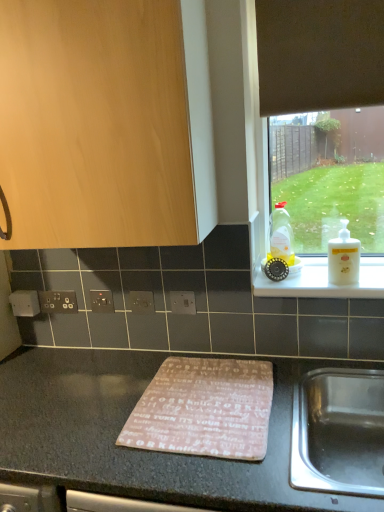
Question: Is wooden cabinet at upper left in front of or behind white plastic ledge at upper right in the image?

Choices:
 (A) front
 (B) behind

Answer: (A)

Question: Considering the positions of wooden cabinet at upper left and white plastic ledge at upper right in the image, is wooden cabinet at upper left wider or thinner than white plastic ledge at upper right?

Choices:
 (A) thin
 (B) wide

Answer: (B)

Question: Considering the real-world distances, which object is farthest from the satin silver switch at center, which is counted as the third electric outlet, starting from the left?

Choices:
 (A) matte gray electric outlet at center, acting as the 4th electric outlet starting from the left
 (B) black plastic electric outlet at center, positioned as the second electric outlet in left-to-right order
 (C) wooden cabinet at upper left
 (D) translucent plastic bottle at right, which is the 2th bottle from right to left
 (E) black plastic electrical outlet at lower left, marked as the 1th electric outlet in a left-to-right arrangement

Answer: (C)

Question: Estimate the real-world distances between objects in this image. Which object is closer to the pink fabric mat at center?

Choices:
 (A) matte gray electric outlet at center, acting as the 4th electric outlet starting from the left
 (B) satin silver switch at center, acting as the 2th electric outlet starting from the right
 (C) wooden cabinet at upper left
 (D) black plastic electrical outlet at lower left, marked as the 1th electric outlet in a left-to-right arrangement
 (E) white glossy lotion at right, marked as the 1th bottle in a right-to-left arrangement

Answer: (A)